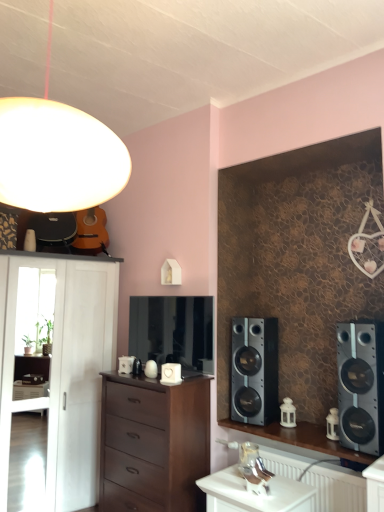
Image resolution: width=384 pixels, height=512 pixels. Describe the element at coordinates (255, 495) in the screenshot. I see `white glossy table at lower center` at that location.

In order to face white glossy table at lower center, should I rotate leftwards or rightwards?

You should rotate right by 8.653 degrees.

This screenshot has width=384, height=512. What are the coordinates of `matte white globe at upper left` in the screenshot? It's located at (57, 154).

Describe the element at coordinates (361, 385) in the screenshot. The image size is (384, 512). I see `satin silver speaker at right, positioned as the first speaker in front-to-back order` at that location.

Measure the distance between wooden desk at right and camera.

wooden desk at right is 2.56 meters away from camera.

What do you see at coordinates (153, 443) in the screenshot? I see `brown wood chest of drawers at center` at bounding box center [153, 443].

Identify the location of satin silver speaker at right, placed as the first speaker when sorted from back to front. This screenshot has width=384, height=512. (254, 370).

Which of these two, white porcelain lantern at center or satin silver speaker at right, positioned as the 2th speaker in back-to-front order, stands taller?

Standing taller between the two is satin silver speaker at right, positioned as the 2th speaker in back-to-front order.

Do you think white porcelain lantern at center is within satin silver speaker at right, positioned as the 2th speaker in back-to-front order, or outside of it?

white porcelain lantern at center is outside satin silver speaker at right, positioned as the 2th speaker in back-to-front order.

From the picture: In terms of size, does white porcelain lantern at center appear bigger or smaller than satin silver speaker at right, positioned as the 2th speaker in back-to-front order?

Considering their sizes, white porcelain lantern at center takes up less space than satin silver speaker at right, positioned as the 2th speaker in back-to-front order.

What's the angular difference between white porcelain lantern at center and brown wood chest of drawers at center's facing directions?

The angle between the facing direction of white porcelain lantern at center and the facing direction of brown wood chest of drawers at center is 4.5 degrees.

From the image's perspective, between white porcelain lantern at center and brown wood chest of drawers at center, which one is located above?

white porcelain lantern at center appears higher in the image.

Considering the positions of objects white porcelain lantern at center and brown wood chest of drawers at center in the image provided, who is more to the right, white porcelain lantern at center or brown wood chest of drawers at center?

Positioned to the right is white porcelain lantern at center.

Is white porcelain lantern at center looking in the opposite direction of brown wood chest of drawers at center?

white porcelain lantern at center does not have its back to brown wood chest of drawers at center.

Would you consider wooden desk at right to be distant from brown wood chest of drawers at center?

wooden desk at right is near brown wood chest of drawers at center, not far away.

From the image's perspective, would you say wooden desk at right is shown under brown wood chest of drawers at center?

No, from the image's perspective, wooden desk at right is not below brown wood chest of drawers at center.

I want to click on desk on the right of the brown wood chest of drawers at center, so click(x=301, y=438).

Considering the relative sizes of wooden desk at right and brown wood chest of drawers at center in the image provided, is wooden desk at right taller than brown wood chest of drawers at center?

Incorrect, the height of wooden desk at right is not larger of that of brown wood chest of drawers at center.

Which is in front, point (220, 503) or point (19, 203)?

The point (19, 203) is in front.

Is white glossy table at lower center taller than matte white globe at upper left?

No.

Which is more to the left, white glossy table at lower center or matte white globe at upper left?

matte white globe at upper left.

From the image's perspective, is white glossy table at lower center on top of matte white globe at upper left?

No, from the image's perspective, white glossy table at lower center is not over matte white globe at upper left.

Does white matte cabinet at left have a smaller size compared to wooden desk at right?

Actually, white matte cabinet at left might be larger than wooden desk at right.

Considering the sizes of objects white matte cabinet at left and wooden desk at right in the image provided, who is shorter, white matte cabinet at left or wooden desk at right?

With less height is wooden desk at right.

Is white matte cabinet at left spatially inside wooden desk at right, or outside of it?

white matte cabinet at left is outside wooden desk at right.

Based on the photo, is brown wood chest of drawers at center bigger than white glossy table at lower center?

Yes.

How different are the orientations of brown wood chest of drawers at center and white glossy table at lower center in degrees?

2.28 degrees.

From the image's perspective, does brown wood chest of drawers at center appear higher than white glossy table at lower center?

Yes, from the image's perspective, brown wood chest of drawers at center is on top of white glossy table at lower center.

Is there a large distance between brown wood chest of drawers at center and white matte cabinet at left?

brown wood chest of drawers at center is near white matte cabinet at left, not far away.

Considering their positions, is brown wood chest of drawers at center located in front of or behind white matte cabinet at left?

brown wood chest of drawers at center is in front of white matte cabinet at left.

Where is `shelf that appears above the brown wood chest of drawers at center (from the image's perspective)`? shelf that appears above the brown wood chest of drawers at center (from the image's perspective) is located at coordinates (62, 370).

From the image's perspective, between brown wood chest of drawers at center and white matte cabinet at left, which one is located above?

From the image's view, white matte cabinet at left is above.

What are the coordinates of `the 2nd speaker above when counting from the white porcelain lantern at center (from the image's perspective)` in the screenshot? It's located at (361, 385).

Identify the location of the chest of drawers located in front of the white porcelain lantern at center. The height and width of the screenshot is (512, 384). (153, 443).

From the image, which object appears to be nearer to satin silver speaker at right, which is the 2th speaker from left to right, wooden desk at right or white porcelain lantern at center?

wooden desk at right is closer to satin silver speaker at right, which is the 2th speaker from left to right.

Based on their spatial positions, is brown wood chest of drawers at center or white porcelain lantern at center further from white glossy table at lower center?

white porcelain lantern at center.

From the image, which object appears to be farther from white glossy table at lower center, matte white globe at upper left or white porcelain lantern at center?

Among the two, matte white globe at upper left is located further to white glossy table at lower center.

From the image, which object appears to be nearer to brown wood chest of drawers at center, white porcelain lantern at center or white matte cabinet at left?

white matte cabinet at left is closer to brown wood chest of drawers at center.

Looking at this image, which object lies nearer to the anchor point satin silver speaker at right, which appears as the 1th speaker when viewed from the left, white porcelain lantern at center or white matte cabinet at left?

white porcelain lantern at center is closer to satin silver speaker at right, which appears as the 1th speaker when viewed from the left.

Looking at the image, which one is located closer to white matte cabinet at left, white glossy table at lower center or white porcelain lantern at center?

white glossy table at lower center.

Looking at the image, which one is located closer to white matte cabinet at left, matte white globe at upper left or wooden desk at right?

Based on the image, wooden desk at right appears to be nearer to white matte cabinet at left.

When comparing their distances from white matte cabinet at left, does white glossy table at lower center or satin silver speaker at right, which is the 2th speaker from left to right, seem closer?

white glossy table at lower center lies closer to white matte cabinet at left than the other object.

In order to click on speaker situated between white matte cabinet at left and white porcelain lantern at center from left to right in this screenshot , I will do `click(254, 370)`.

Find the location of a particular element. The width and height of the screenshot is (384, 512). the chest of drawers situated between white matte cabinet at left and wooden desk at right from left to right is located at coordinates (153, 443).

This screenshot has width=384, height=512. Identify the location of shelf between matte white globe at upper left and brown wood chest of drawers at center in the vertical direction. (62, 370).

This screenshot has height=512, width=384. In order to click on toy between matte white globe at upper left and white glossy table at lower center in the up-down direction in this screenshot , I will do `click(288, 413)`.